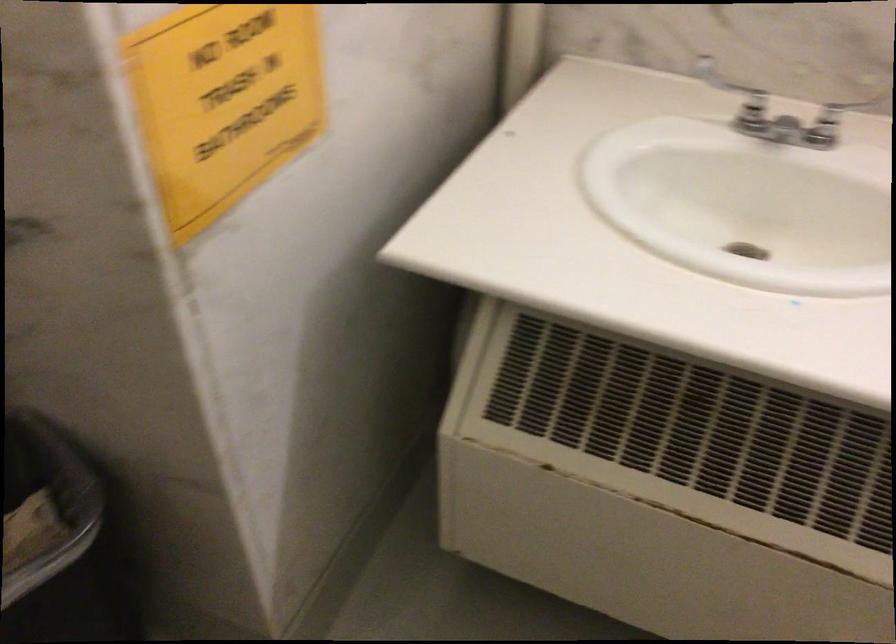
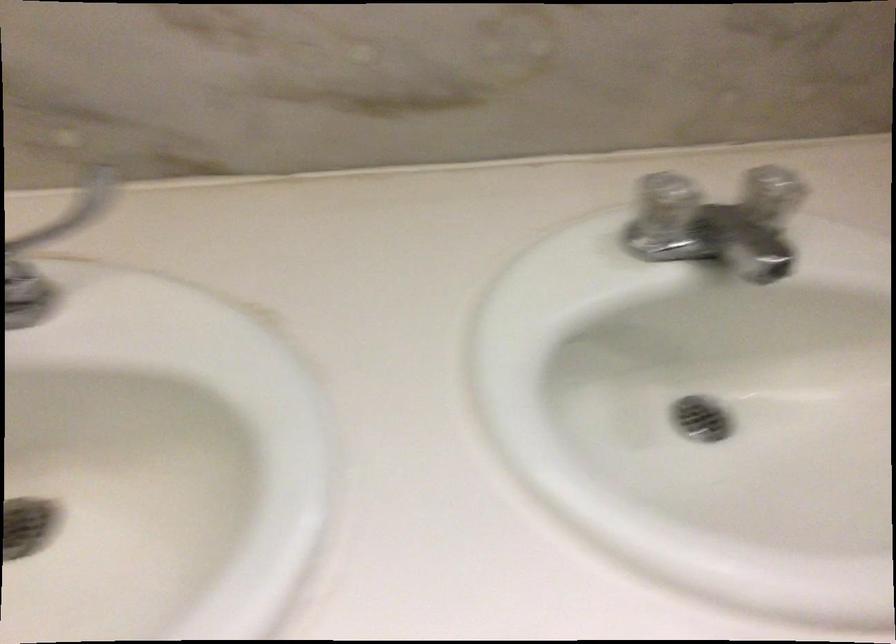
Question: The camera is either moving clockwise (left) or counter-clockwise (right) around the object. The first image is from the beginning of the video and the second image is from the end. Is the camera moving left or right when shooting the video?

Choices:
 (A) Left
 (B) Right

Answer: (A)